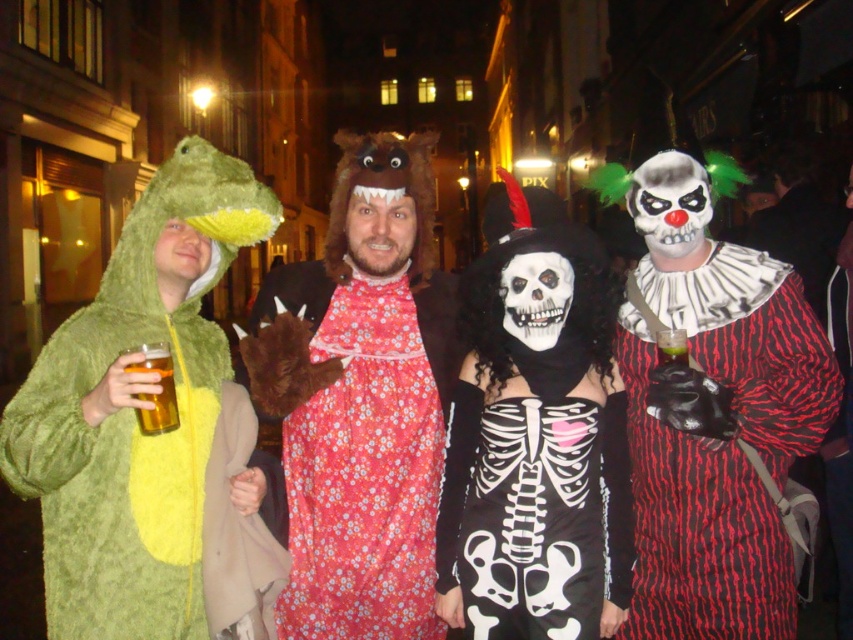
Question: Which object is positioned closest to the floral fabric dress at center?

Choices:
 (A) translucent plastic cup at center
 (B) fluffy green dinosaur at left
 (C) red striped clown at right

Answer: (C)

Question: Which object appears farthest from the camera in this image?

Choices:
 (A) floral fabric dress at center
 (B) red striped clown at right
 (C) translucent plastic cup at center

Answer: (A)

Question: Which object is closer to the camera taking this photo?

Choices:
 (A) floral fabric dress at center
 (B) fluffy green dinosaur at left

Answer: (B)

Question: Can you confirm if floral fabric dress at center is positioned above translucent plastic cup at center?

Choices:
 (A) yes
 (B) no

Answer: (B)

Question: Can you confirm if red striped clown at right is positioned to the right of translucent plastic cup at center?

Choices:
 (A) no
 (B) yes

Answer: (B)

Question: Can you confirm if red striped clown at right is smaller than translucent plastic cup at center?

Choices:
 (A) yes
 (B) no

Answer: (B)